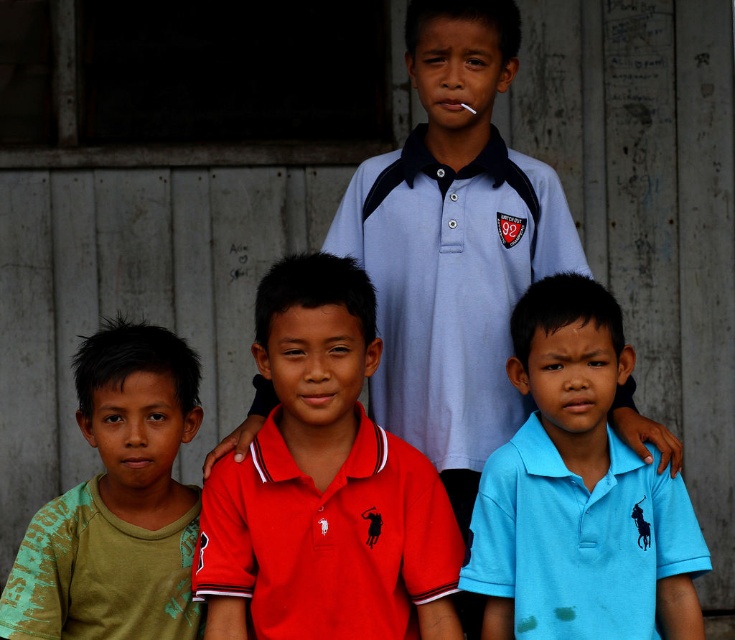
Question: Which of the following is the farthest from the observer?

Choices:
 (A) blue cotton shirt at center
 (B) green cotton shirt at lower left

Answer: (B)

Question: Is red matte polo shirt at center smaller than green cotton shirt at lower left?

Choices:
 (A) yes
 (B) no

Answer: (B)

Question: Which point is farther to the camera?

Choices:
 (A) (609, 468)
 (B) (318, 572)

Answer: (A)

Question: Which of the following is the farthest from the observer?

Choices:
 (A) red matte polo shirt at center
 (B) green cotton shirt at lower left

Answer: (B)

Question: Does blue cotton shirt at center appear on the right side of green cotton shirt at lower left?

Choices:
 (A) yes
 (B) no

Answer: (A)

Question: Where is blue cotton shirt at center located in relation to green cotton shirt at lower left in the image?

Choices:
 (A) right
 (B) left

Answer: (A)